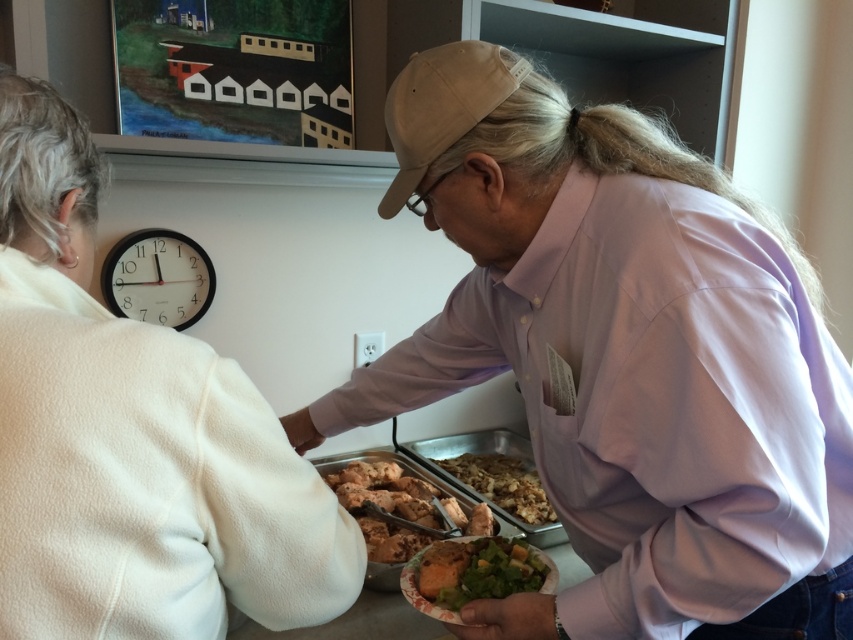
Question: Can you confirm if white fleece jacket at upper left is positioned above golden brown mashed potatoes at center?

Choices:
 (A) no
 (B) yes

Answer: (B)

Question: Which object appears closest to the camera in this image?

Choices:
 (A) golden brown bread at lower center
 (B) pink cotton shirt at center
 (C) golden brown mashed potatoes at center

Answer: (B)

Question: From the image, what is the correct spatial relationship of white fleece jacket at upper left in relation to golden brown mashed potatoes at center?

Choices:
 (A) right
 (B) left

Answer: (B)

Question: Among these objects, which one is farthest from the camera?

Choices:
 (A) golden brown bread at lower center
 (B) golden brown mashed potatoes at center
 (C) white fleece jacket at upper left

Answer: (B)

Question: Which is nearer to the white fleece jacket at upper left?

Choices:
 (A) brown matte chicken at center
 (B) golden brown mashed potatoes at center

Answer: (A)

Question: Does white fleece jacket at upper left appear on the left side of golden brown mashed potatoes at center?

Choices:
 (A) yes
 (B) no

Answer: (A)